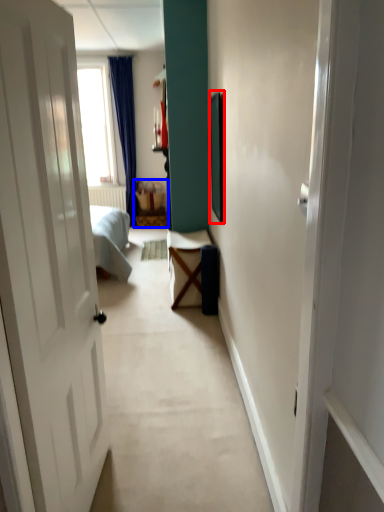
Question: Which object appears farthest to the camera in this image, picture frame (highlighted by a red box) or furniture (highlighted by a blue box)?

Choices:
 (A) picture frame
 (B) furniture

Answer: (B)